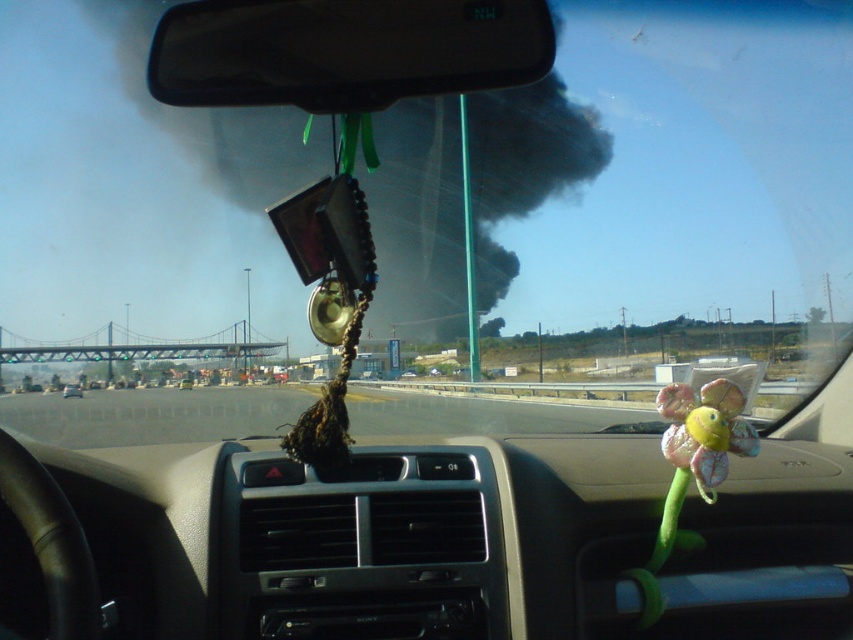
Measure the distance from multicolored fabric flower at center to metallic silver car at center.

A distance of 35.40 meters exists between multicolored fabric flower at center and metallic silver car at center.

Does multicolored fabric flower at center have a greater width compared to metallic silver car at center?

No, multicolored fabric flower at center is not wider than metallic silver car at center.

This screenshot has width=853, height=640. What do you see at coordinates (692, 467) in the screenshot? I see `multicolored fabric flower at center` at bounding box center [692, 467].

Identify the location of multicolored fabric flower at center. (692, 467).

Does black plastic view mirror at upper center appear over smooth asphalt highway at center?

Indeed, black plastic view mirror at upper center is positioned over smooth asphalt highway at center.

Which of these two, black plastic view mirror at upper center or smooth asphalt highway at center, stands taller?

With more height is smooth asphalt highway at center.

Is point (192, 4) farther from viewer compared to point (86, 404)?

No, (192, 4) is in front of (86, 404).

Where is `black plastic view mirror at upper center`? black plastic view mirror at upper center is located at coordinates (344, 51).

Is black matte smoke at center to the right of multicolored fabric flower at center from the viewer's perspective?

In fact, black matte smoke at center is to the left of multicolored fabric flower at center.

From the picture: Does black matte smoke at center appear over multicolored fabric flower at center?

Indeed, black matte smoke at center is positioned over multicolored fabric flower at center.

The width and height of the screenshot is (853, 640). What are the coordinates of `black matte smoke at center` in the screenshot? It's located at (419, 220).